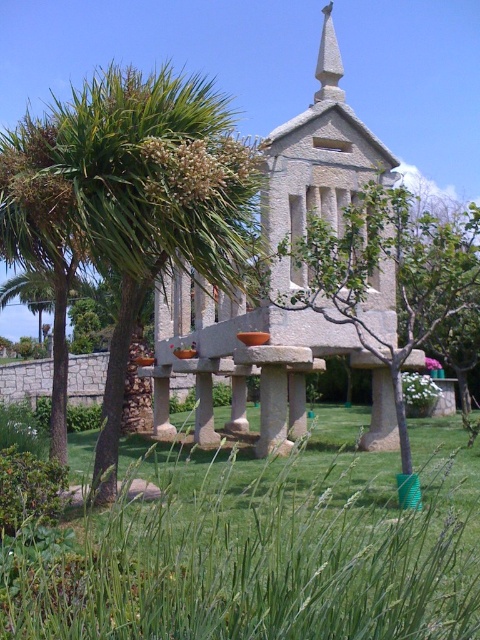
You are planning to take a photo of the stone chapel at center and the white stone spire at upper center. Which object should you focus on first if you want to capture both in a single frame without moving the camera?

The stone chapel at center should be focused on first since it is larger in size compared to the white stone spire at upper center, allowing it to anchor the composition while still including the spire in the frame.

You are standing in the outdoor area and want to take a photo of the stone chapel at center and the white stone spire at upper center. If you position yourself so that both are in the frame, which one will appear larger in the photo?

The stone chapel at center will appear larger in the photo because it is in front of the white stone spire at upper center, making it closer to the camera and thus larger in the image.

Consider the image. You are planning to place a small garden statue that requires a 2 square feet space. Given the green grass at center and the green leafy palm tree at center, which area would be suitable for placing the statue?

The green grass at center has a smaller size compared to the green leafy palm tree at center, so the statue can be placed on the green grass at center as it requires less space.